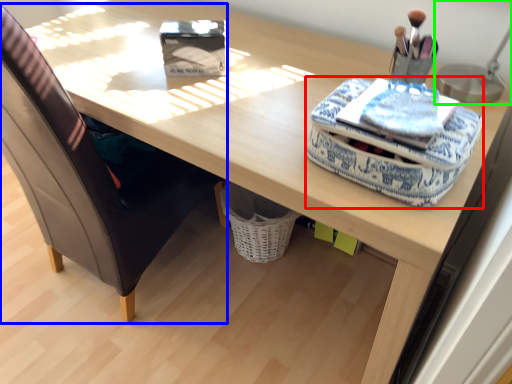
Question: Considering the real-world distances, which object is closest to material (highlighted by a red box)? chair (highlighted by a blue box) or table lamp (highlighted by a green box).

Choices:
 (A) chair
 (B) table lamp

Answer: (B)